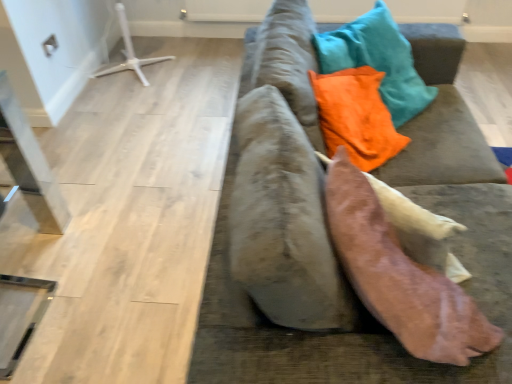
This screenshot has width=512, height=384. I want to click on free space to the left of velvet gray couch at center, so click(x=122, y=230).